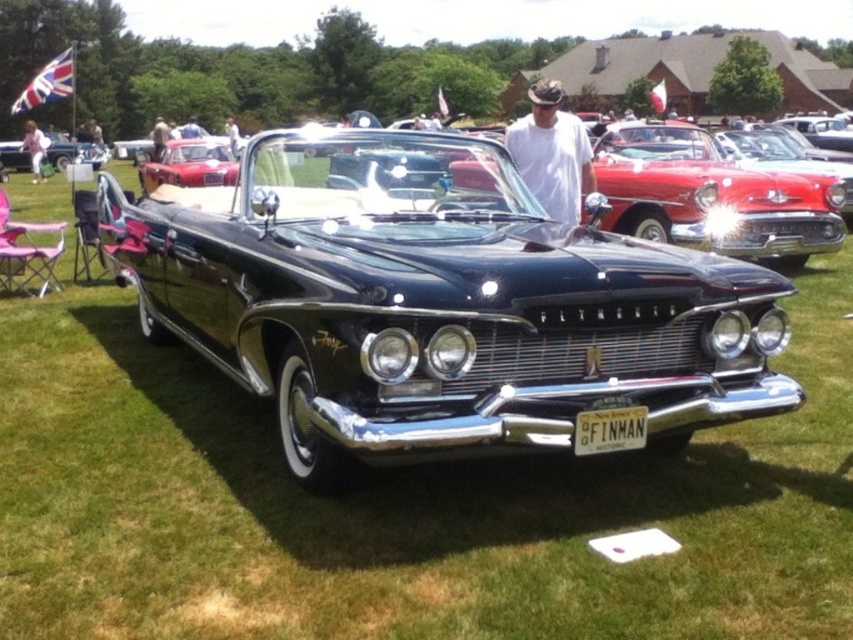
You are a photographer at the classic car exhibition and want to take a picture of the vintage Plymouth Fury. However, there is a white cotton shirt at center blocking your view. Can you move the shirt to the left or right to get an unobstructed shot of the car?

Move the white cotton shirt at center to the right or left to get an unobstructed shot of the vintage Plymouth Fury.

Based on the photo, you are a photographer at the car exhibition. You want to take a photo of the shiny black car at center and the shiny black convertible at center. However, you notice that one of them is blocking the other. Which car is blocking the other?

The shiny black car at center is blocking the shiny black convertible at center because it is in front of it.